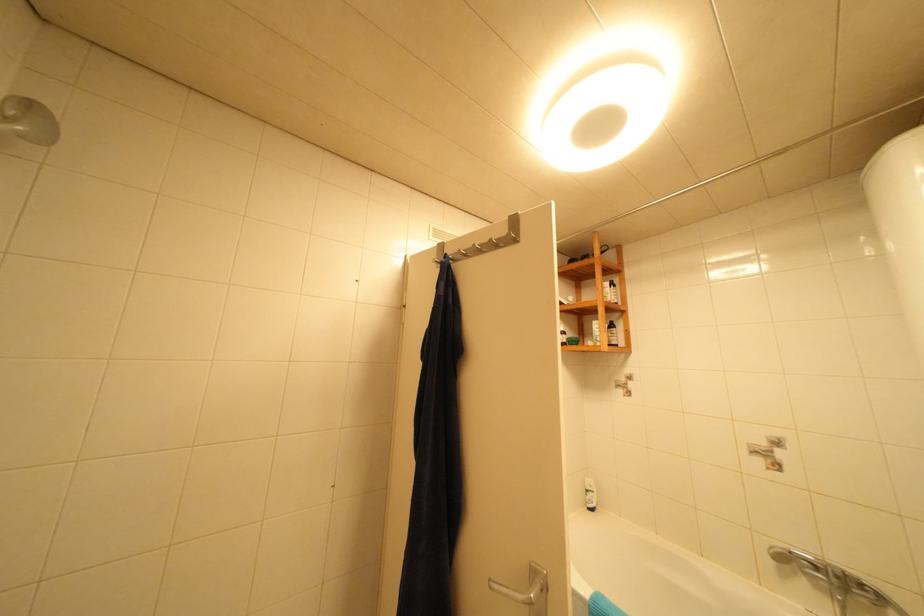
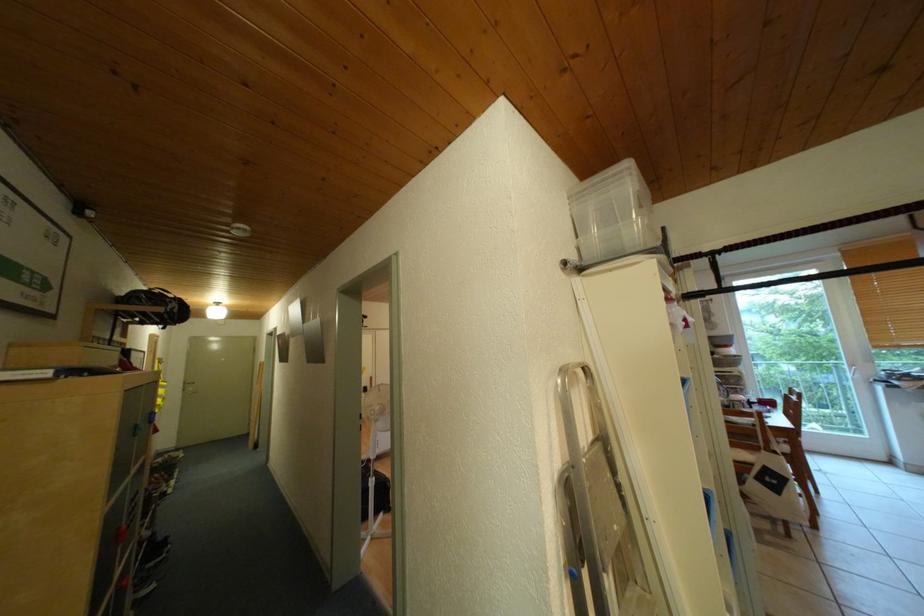
In a continuous first-person perspective shot, in which direction is the camera moving?

The cameraman walked toward left, forward.